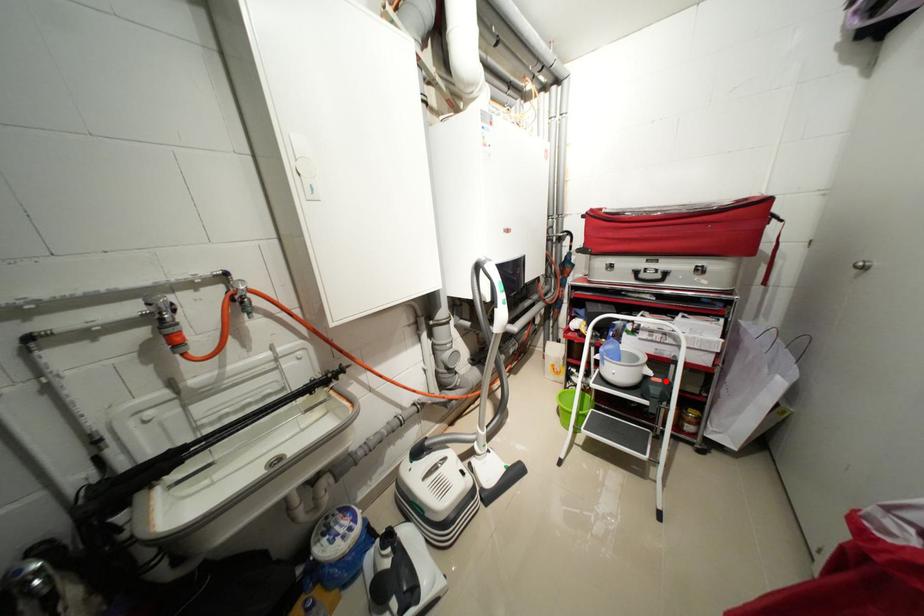
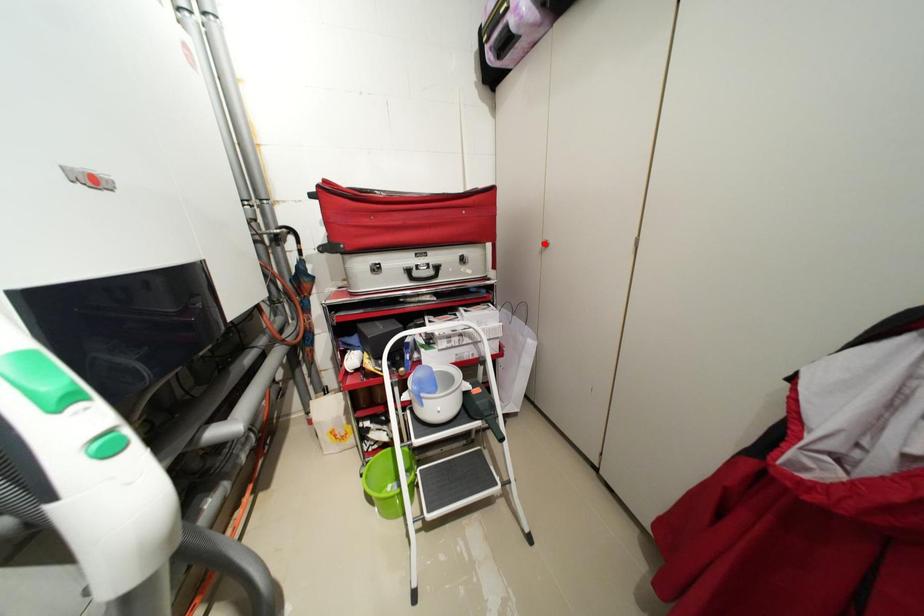
I am providing you with two images of the same scene from different viewpoints. A red point is marked on the first image and another point is marked on the second image. Is the marked point in image1 the same physical position as the marked point in image2?

No